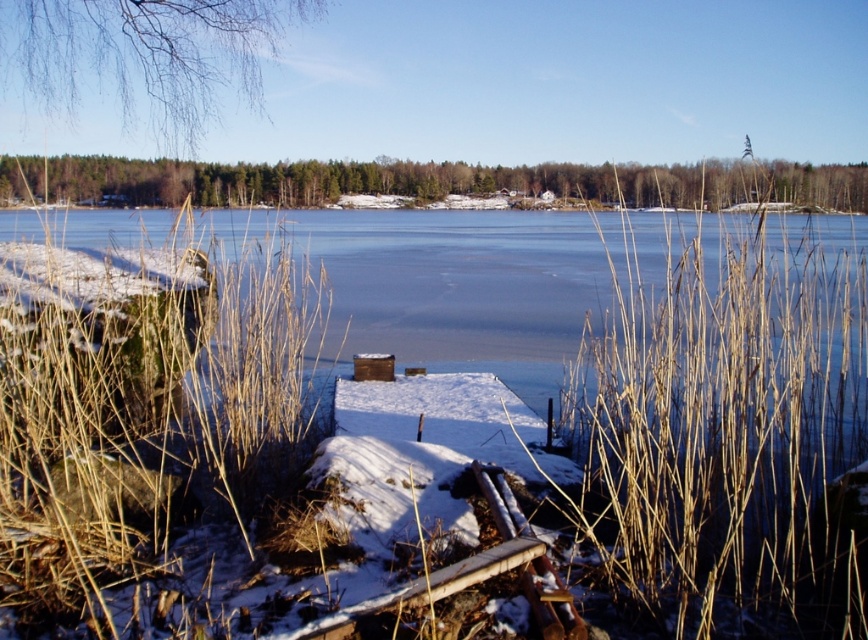
Can you confirm if brown dry reed at center is thinner than transparent ice at center?

Correct, brown dry reed at center's width is less than transparent ice at center's.

Is brown dry reed at center shorter than transparent ice at center?

No, brown dry reed at center is not shorter than transparent ice at center.

The width and height of the screenshot is (868, 640). Describe the element at coordinates (728, 436) in the screenshot. I see `brown dry reed at center` at that location.

In order to click on brown dry reed at center in this screenshot , I will do `click(728, 436)`.

Does brown dry reed at lower left appear on the left side of transparent ice at center?

Yes, brown dry reed at lower left is to the left of transparent ice at center.

Who is taller, brown dry reed at lower left or transparent ice at center?

With more height is transparent ice at center.

Between point (152, 348) and point (100, 244), which one is positioned in front?

Point (152, 348) is in front.

Locate an element on the screen. The width and height of the screenshot is (868, 640). brown dry reed at lower left is located at coordinates (142, 406).

Who is lower down, brown dry reed at center or brown dry reed at lower left?

brown dry reed at lower left

Between point (725, 586) and point (133, 500), which one is positioned in front?

Point (725, 586) is in front.

Is point (845, 364) positioned after point (30, 330)?

No, (845, 364) is closer to viewer.

Identify the location of brown dry reed at center. The height and width of the screenshot is (640, 868). (728, 436).